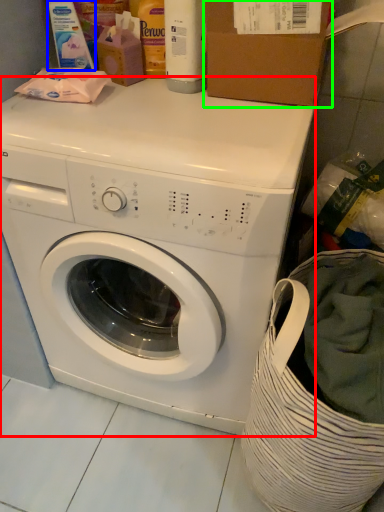
Question: Which is nearer to the washing machine (highlighted by a red box)? cleaning product (highlighted by a blue box) or cardboard box (highlighted by a green box).

Choices:
 (A) cleaning product
 (B) cardboard box

Answer: (B)